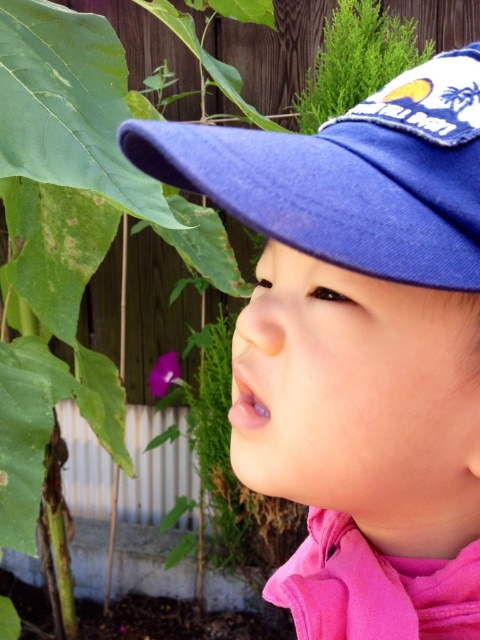
Question: In this image, where is blue fabric cap at upper center located relative to blue fabric baseball cap at upper center?

Choices:
 (A) above
 (B) below

Answer: (B)

Question: Which of the following is the closest to the observer?

Choices:
 (A) (328, 580)
 (B) (425, 220)

Answer: (B)

Question: Does blue fabric cap at upper center appear over blue fabric baseball cap at upper center?

Choices:
 (A) no
 (B) yes

Answer: (A)

Question: Is blue fabric cap at upper center behind blue fabric baseball cap at upper center?

Choices:
 (A) yes
 (B) no

Answer: (B)

Question: Which of the following is the farthest from the observer?

Choices:
 (A) blue fabric cap at upper center
 (B) blue fabric baseball cap at upper center

Answer: (B)